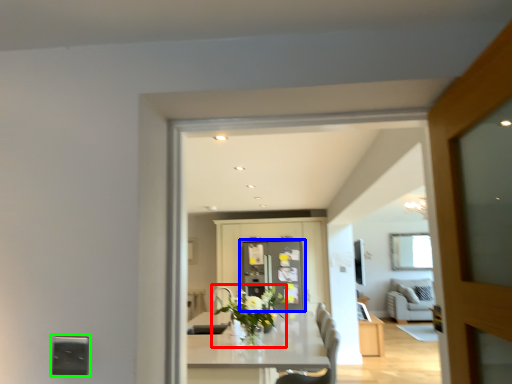
Question: Which is nearer to the plant (highlighted by a red box)? screen door (highlighted by a blue box) or electric outlet (highlighted by a green box).

Choices:
 (A) screen door
 (B) electric outlet

Answer: (A)